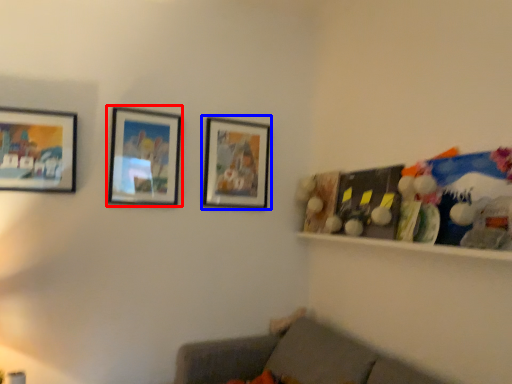
Question: Which point is closer to the camera, picture frame (highlighted by a red box) or picture frame (highlighted by a blue box)?

Choices:
 (A) picture frame
 (B) picture frame

Answer: (A)